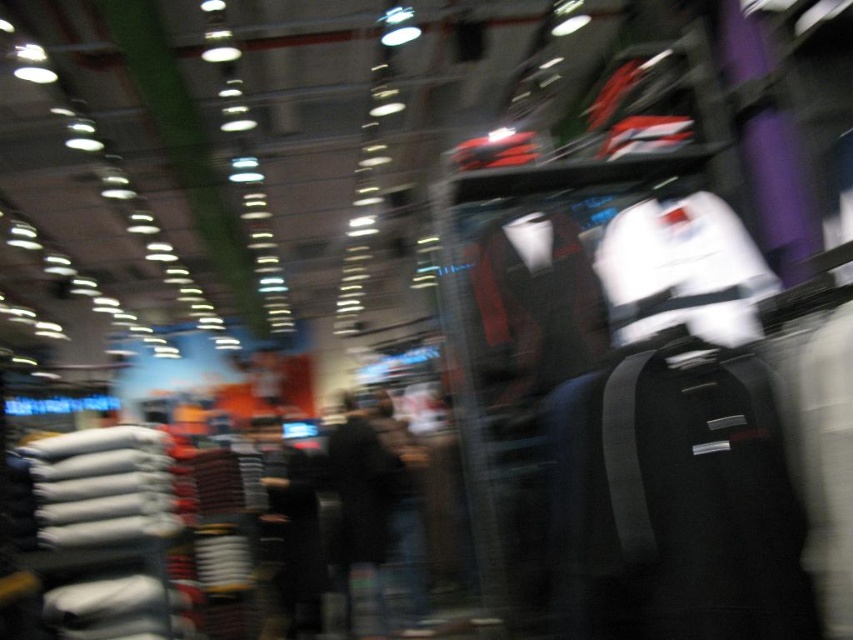
Is white matte jacket at upper center above black fabric jacket at center?

Yes, white matte jacket at upper center is above black fabric jacket at center.

Who is shorter, white matte jacket at upper center or black fabric jacket at center?

Standing shorter between the two is white matte jacket at upper center.

Measure the distance between white matte jacket at upper center and camera.

white matte jacket at upper center and camera are 1.53 meters apart from each other.

Find the location of a particular element. white matte jacket at upper center is located at coordinates (682, 269).

Between black fabric bag at right and velvet-like red jacket at center, which one has less height?

velvet-like red jacket at center

Between black fabric bag at right and velvet-like red jacket at center, which one appears on the right side from the viewer's perspective?

From the viewer's perspective, black fabric bag at right appears more on the right side.

Image resolution: width=853 pixels, height=640 pixels. What do you see at coordinates (675, 500) in the screenshot?
I see `black fabric bag at right` at bounding box center [675, 500].

The height and width of the screenshot is (640, 853). I want to click on black fabric bag at right, so click(675, 500).

From the picture: Between velvet-like red jacket at center and dark gray fabric pants at center, which one has more height?

With more height is dark gray fabric pants at center.

Is point (543, 285) positioned after point (289, 477)?

No, (543, 285) is in front of (289, 477).

Where is `velvet-like red jacket at center`? velvet-like red jacket at center is located at coordinates (537, 310).